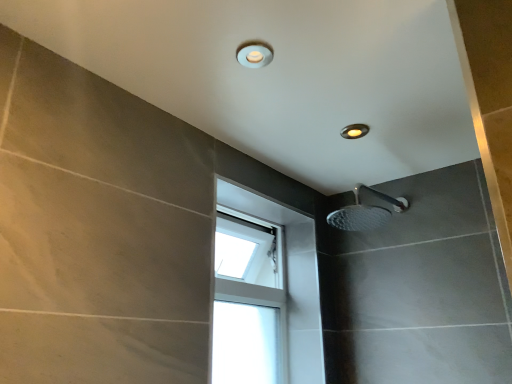
What do you see at coordinates (288, 275) in the screenshot? This screenshot has width=512, height=384. I see `transparent glass window at center` at bounding box center [288, 275].

What is the approximate height of transparent glass window at center?

25.07 inches.

Identify the location of transparent glass window at center. (288, 275).

In order to face transparent glass window at center, should I rotate leftwards or rightwards?

Rotate left and turn 1.405 degrees.

Where is `transparent glass window at center`? The image size is (512, 384). transparent glass window at center is located at coordinates (288, 275).